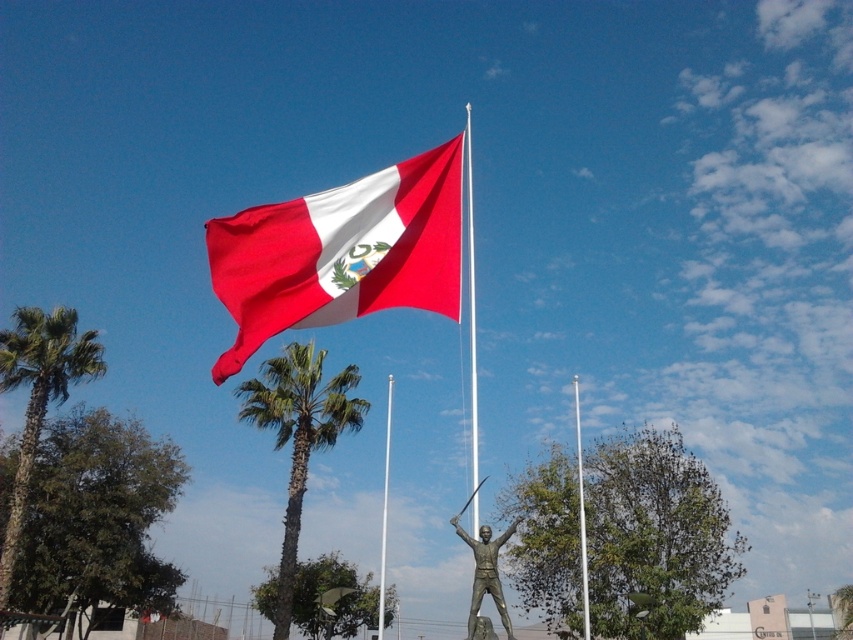
You are a photographer wanting to capture the polished bronze statue at center and the white glossy flag pole at center in a single shot. Since both are in the center, how are they arranged vertically?

The polished bronze statue at center is positioned over the white glossy flag pole at center, so the statue is above the flag pole in the vertical arrangement.

You are standing in front of the polished bronze statue at center and want to see the green leafy palm tree at center. Which direction should you look relative to the statue?

The green leafy palm tree at center is located below the polished bronze statue at center, so you should look downward to see it.

You are an artist trying to paint this scene. You want to ensure the matte fabric flag at upper center and the white glossy flag pole at center are proportionally accurate. Which object should you make smaller in your painting?

The matte fabric flag at upper center should be made smaller in the painting since it occupies less space than the white glossy flag pole at center according to the description.